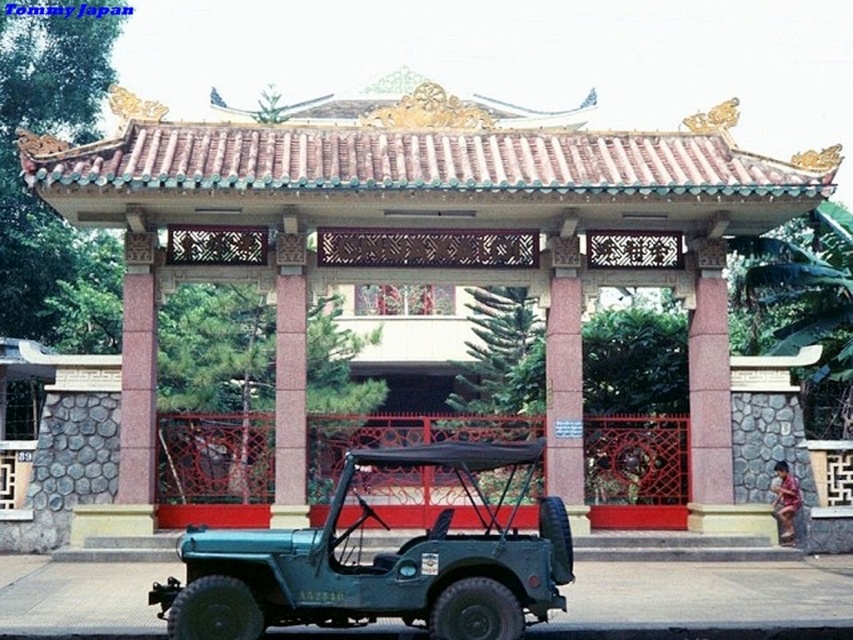
Who is higher up, matte pink gazebo at center or teal matte jeep at center?

matte pink gazebo at center is above.

Does matte pink gazebo at center have a larger size compared to teal matte jeep at center?

Indeed, matte pink gazebo at center has a larger size compared to teal matte jeep at center.

Who is more forward, (612,164) or (465,611)?

Point (465,611) is more forward.

The width and height of the screenshot is (853, 640). Identify the location of matte pink gazebo at center. (421, 250).